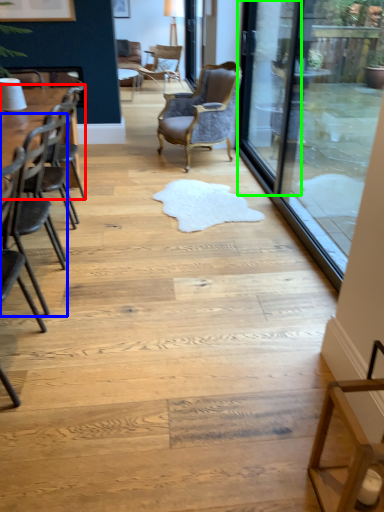
Question: Which object is the closest to the table (highlighted by a red box)? Choose among these: chair (highlighted by a blue box) or screen door (highlighted by a green box).

Choices:
 (A) chair
 (B) screen door

Answer: (A)